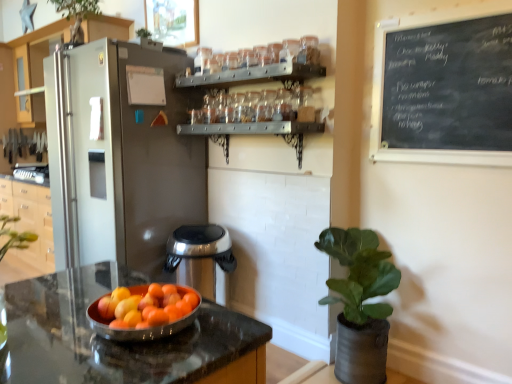
Question: In the image, is green leafy plant at upper center on the left side or the right side of black chalkboard at upper right?

Choices:
 (A) left
 (B) right

Answer: (A)

Question: From a real-world perspective, is green leafy plant at upper center positioned above or below black chalkboard at upper right?

Choices:
 (A) above
 (B) below

Answer: (A)

Question: Estimate the real-world distances between objects in this image. Which object is closer to the green matte plant at right?

Choices:
 (A) satin silver refrigerator at left
 (B) shiny metallic bowl at center
 (C) shiny granite countertop at center
 (D) black chalkboard at upper right
 (E) satin silver refrigerator at left

Answer: (D)

Question: Based on their relative distances, which object is farther from the green matte plant at right?

Choices:
 (A) shiny granite countertop at center
 (B) green leafy plant at upper center
 (C) satin silver refrigerator at left
 (D) satin silver refrigerator at left
 (E) shiny metallic bowl at center

Answer: (C)